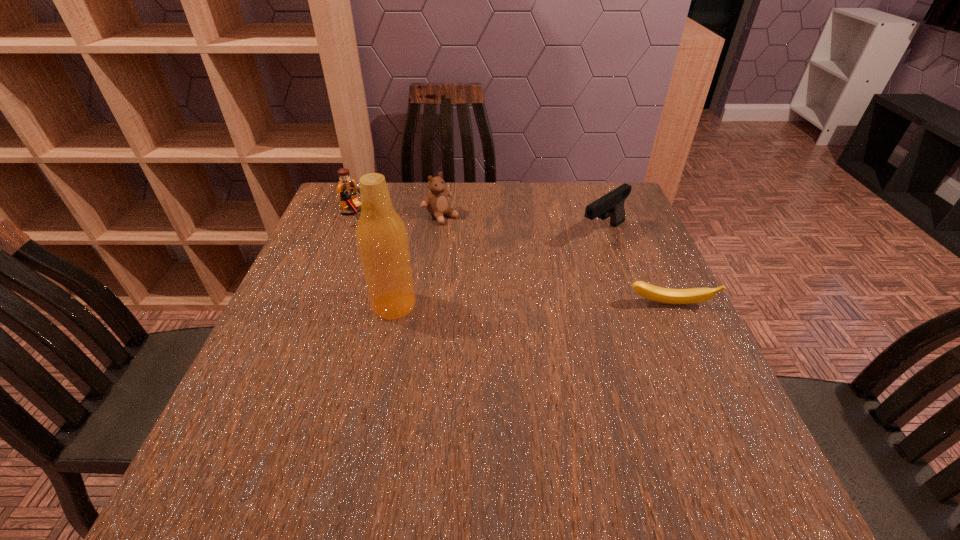
At what (x,y) coordinates should I click in order to perform the action: click on free space between the teddy bear and the beer bottle. Please return your answer as a coordinate pair (x, y). This screenshot has width=960, height=540. Looking at the image, I should click on (418, 260).

Locate an element on the screen. Image resolution: width=960 pixels, height=540 pixels. vacant point located between the banana and the teddy bear is located at coordinates (556, 260).

I want to click on unoccupied position between the banana and the pistol, so click(x=636, y=268).

I want to click on unoccupied position between the pistol and the tallest object, so click(x=498, y=269).

You are a GUI agent. You are given a task and a screenshot of the screen. Output one action in this format:
    pyautogui.click(x=<x>, y=<y>)
    Task: Click on the unoccupied position between the beer bottle and the shortest object
    
    Given the screenshot: What is the action you would take?
    pyautogui.click(x=532, y=305)

At what (x,y) coordinates should I click in order to perform the action: click on empty space that is in between the shortest object and the teddy bear. Please return your answer as a coordinate pair (x, y). Looking at the image, I should click on (556, 260).

Locate an element on the screen. This screenshot has width=960, height=540. free space between the pistol and the banana is located at coordinates (636, 268).

Choose which object is the third nearest neighbor to the teddy bear. Please provide its 2D coordinates. Your answer should be formatted as a tuple, i.e. [(x, y)], where the tuple contains the x and y coordinates of a point satisfying the conditions above.

[(611, 205)]

Identify which object is located as the fourth nearest to the teddy bear. Please provide its 2D coordinates. Your answer should be formatted as a tuple, i.e. [(x, y)], where the tuple contains the x and y coordinates of a point satisfying the conditions above.

[(654, 293)]

Identify the location of free space that satisfies the following two spatial constraints: 1. on the front side of the teddy bear; 2. on the left side of the leftmost object. This screenshot has height=540, width=960. (352, 216).